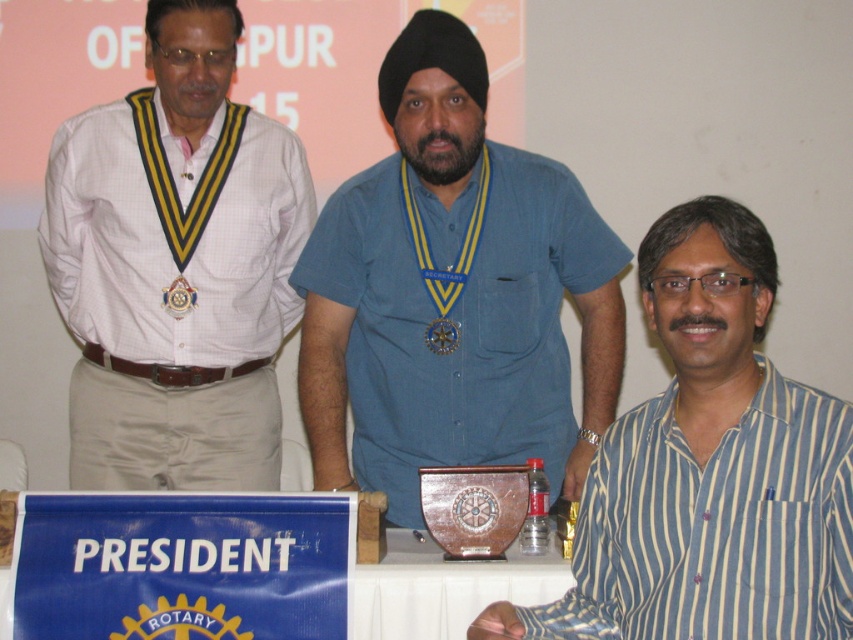
You are standing at the entrance of the event hall and want to place a name tag on the table closest to the center of the room. According to the image, where exactly is the white plastic table at lower center located?

The white plastic table at lower center is located at point (440, 588).

From the picture: You are a photographer adjusting your camera settings to focus on two points in the image. The first point is at coordinates point (177,292) and the second point is at point (427,346). Which point should you focus on first if you want to capture both points clearly in your photo?

You should focus on point (177,292) first because it is closer to the camera than point (427,346). This ensures that the closer point is in focus, and the farther point will also be within the depth of field if properly set.